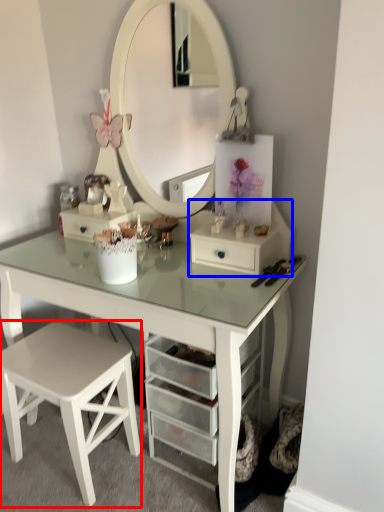
Question: Among these objects, which one is nearest to the camera, stool (highlighted by a red box) or chest of drawers (highlighted by a blue box)?

Choices:
 (A) stool
 (B) chest of drawers

Answer: (A)